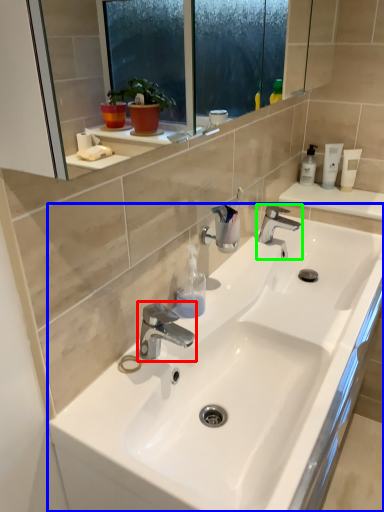
Question: Estimate the real-world distances between objects in this image. Which object is farther from tap (highlighted by a red box), sink (highlighted by a blue box) or tap (highlighted by a green box)?

Choices:
 (A) sink
 (B) tap

Answer: (B)